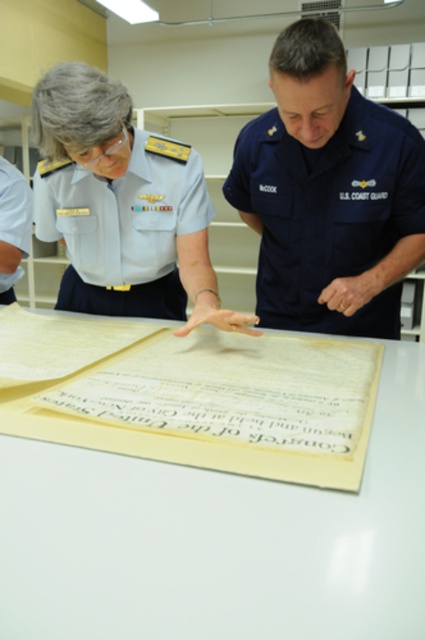
Who is positioned more to the right, white paper at center or white glossy uniform at upper left?

white paper at center is more to the right.

Is point (57, 621) positioned behind point (44, 202)?

No, it is in front of (44, 202).

Who is more forward, (48, 582) or (130, 200)?

Point (48, 582) is in front.

Find the location of a particular element. white paper at center is located at coordinates tap(218, 540).

Is navy blue uniform at center further to camera compared to white fabric uniform at upper left?

No, navy blue uniform at center is closer to the viewer.

Which is more to the left, navy blue uniform at center or white fabric uniform at upper left?

From the viewer's perspective, white fabric uniform at upper left appears more on the left side.

Find the location of a particular element. The image size is (425, 640). navy blue uniform at center is located at coordinates (328, 212).

I want to click on navy blue uniform at center, so click(x=328, y=212).

Is white glossy uniform at upper left to the left of white fabric uniform at upper left from the viewer's perspective?

Incorrect, white glossy uniform at upper left is not on the left side of white fabric uniform at upper left.

Does point (170, 182) come closer to viewer compared to point (13, 257)?

Yes.

This screenshot has height=640, width=425. Find the location of `white glossy uniform at upper left`. white glossy uniform at upper left is located at coordinates (124, 218).